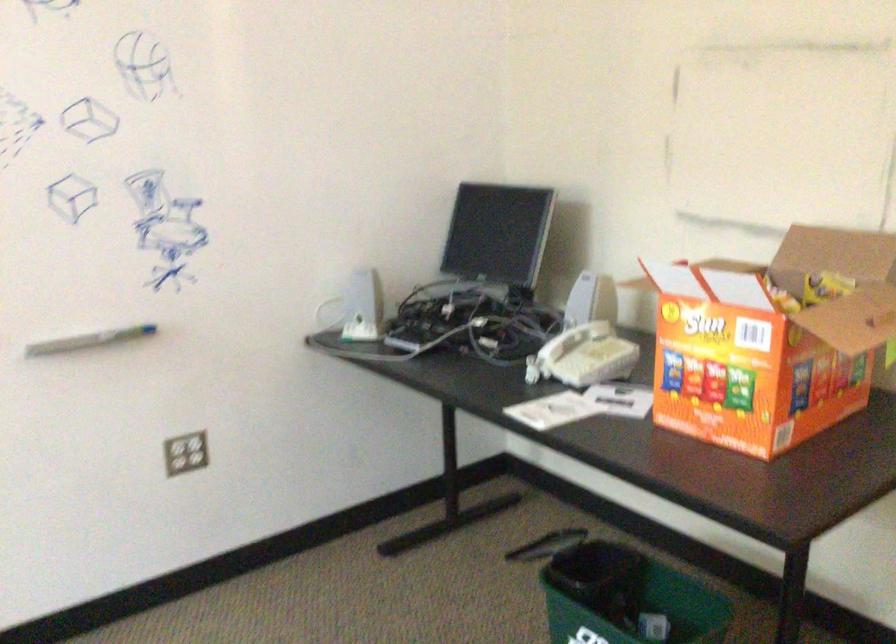
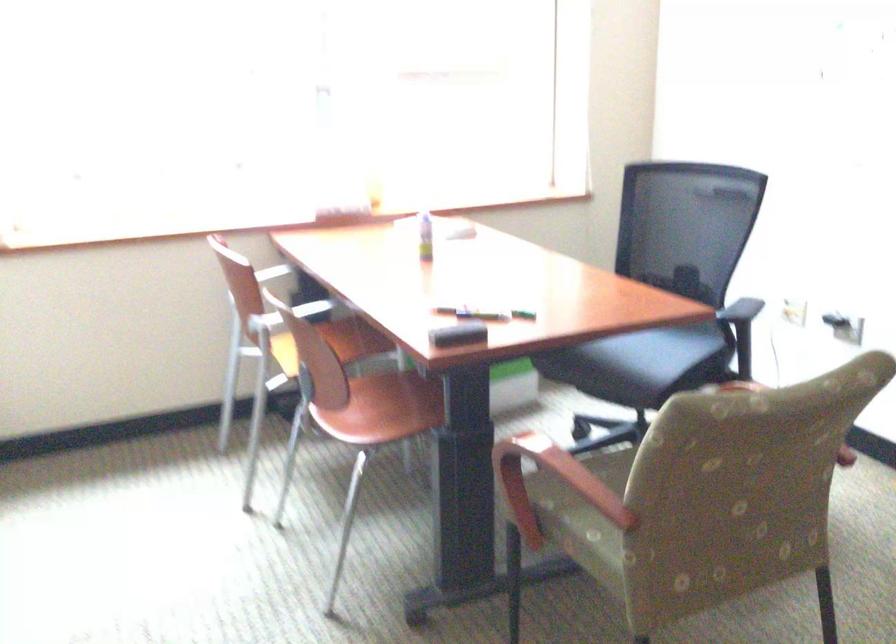
First-person continuous shooting, in which direction is the camera rotating?

The camera's rotation is toward left-down.